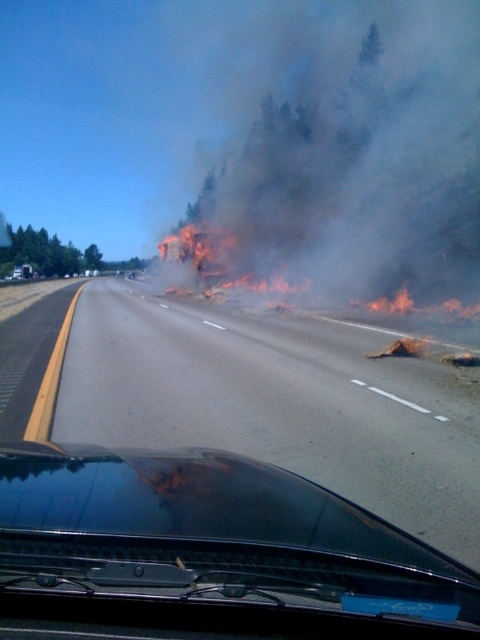
You are driving a car and need to navigate the road ahead. Since the windshield is obstructed by smoke from the wildfire, can you still see the asphalt road at center through the transparent glass windshield at center?

The asphalt road at center is positioned over the transparent glass windshield at center, meaning the road is visible through the windshield despite the smoke obstruction.

You are a driver in a car and you see the black smoke at upper center through the windshield. Based on the smoke location, which direction should you turn to avoid the wildfire?

The black smoke at upper center is located at point (348, 157) in the image, so you should turn left to avoid the wildfire.

You are driving and notice the black smoke at upper center and the transparent glass windshield at center. Based on their sizes, which one is more likely to block your view of the road ahead?

The black smoke at upper center might be wider than the transparent glass windshield at center, so it is more likely to block your view of the road ahead.